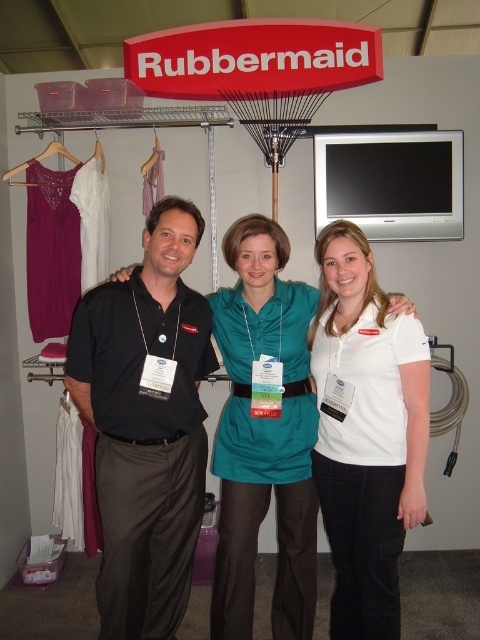
Which is more to the left, white cotton polo shirt at center or teal satin dress at center?

teal satin dress at center

Which is more to the right, white cotton polo shirt at center or teal satin dress at center?

white cotton polo shirt at center

This screenshot has height=640, width=480. I want to click on white cotton polo shirt at center, so click(365, 433).

Where is `white cotton polo shirt at center`? The width and height of the screenshot is (480, 640). white cotton polo shirt at center is located at coordinates (365, 433).

Does black smooth shirt at center appear over white fabric hanger at upper left?

No, black smooth shirt at center is not above white fabric hanger at upper left.

Can you confirm if black smooth shirt at center is wider than white fabric hanger at upper left?

Yes.

Measure the distance between point [167,256] and camera.

The distance of point [167,256] from camera is 6.03 feet.

Where is `black smooth shirt at center`? Image resolution: width=480 pixels, height=640 pixels. black smooth shirt at center is located at coordinates point(145,426).

Who is more forward, [346,458] or [9,173]?

Point [346,458]

Who is higher up, white cotton polo shirt at center or purple fabric hanger at left?

purple fabric hanger at left is higher up.

Find the location of `white cotton polo shirt at center`. white cotton polo shirt at center is located at coordinates (365, 433).